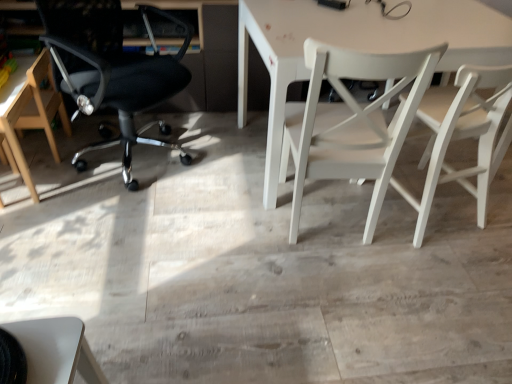
Where is `vacant region under black mesh office chair at left, the 2th chair in the left-to-right sequence (from a real-world perspective)`? vacant region under black mesh office chair at left, the 2th chair in the left-to-right sequence (from a real-world perspective) is located at coordinates (139, 152).